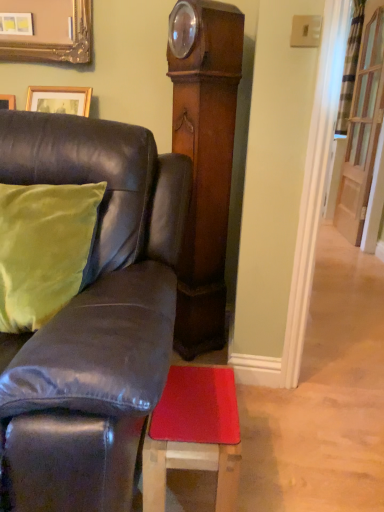
Question: From a real-world perspective, is clear glass door at upper right below green velvet pillow at left?

Choices:
 (A) yes
 (B) no

Answer: (B)

Question: Is green velvet pillow at left at the back of clear glass door at upper right?

Choices:
 (A) yes
 (B) no

Answer: (B)

Question: Is clear glass door at upper right positioned far away from green velvet pillow at left?

Choices:
 (A) no
 (B) yes

Answer: (B)

Question: Considering the relative sizes of clear glass door at upper right and green velvet pillow at left in the image provided, is clear glass door at upper right smaller than green velvet pillow at left?

Choices:
 (A) yes
 (B) no

Answer: (A)

Question: Could you tell me if clear glass door at upper right is turned towards green velvet pillow at left?

Choices:
 (A) no
 (B) yes

Answer: (A)

Question: Can you confirm if clear glass door at upper right is bigger than green velvet pillow at left?

Choices:
 (A) yes
 (B) no

Answer: (B)

Question: Does clear glass door at upper right have a greater height compared to leather couch at left?

Choices:
 (A) yes
 (B) no

Answer: (A)

Question: Does clear glass door at upper right come in front of leather couch at left?

Choices:
 (A) no
 (B) yes

Answer: (A)

Question: Does clear glass door at upper right lie behind leather couch at left?

Choices:
 (A) no
 (B) yes

Answer: (B)

Question: From the image's perspective, would you say clear glass door at upper right is shown under leather couch at left?

Choices:
 (A) no
 (B) yes

Answer: (A)

Question: Is clear glass door at upper right far from leather couch at left?

Choices:
 (A) yes
 (B) no

Answer: (A)

Question: Considering the relative sizes of clear glass door at upper right and leather couch at left in the image provided, is clear glass door at upper right thinner than leather couch at left?

Choices:
 (A) yes
 (B) no

Answer: (A)

Question: Is leather couch at left wider than clear glass door at upper right?

Choices:
 (A) no
 (B) yes

Answer: (B)